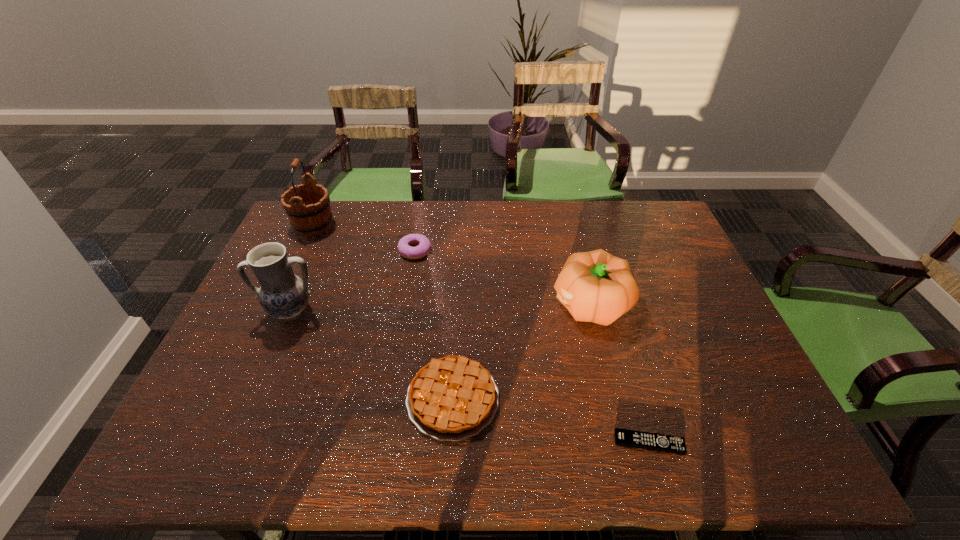
At what (x,y) coordinates should I click in order to perform the action: click on vacant region located 0.320m on the carved face of the third tallest object. Please return your answer as a coordinate pair (x, y). The width and height of the screenshot is (960, 540). Looking at the image, I should click on (437, 304).

The height and width of the screenshot is (540, 960). Find the location of `vacant space located 0.180m on the front of the doughnut`. vacant space located 0.180m on the front of the doughnut is located at coordinates (406, 304).

At what (x,y) coordinates should I click in order to perform the action: click on free space located on the right of the pie. Please return your answer as a coordinate pair (x, y). The image size is (960, 540). Looking at the image, I should click on (x=525, y=399).

This screenshot has height=540, width=960. In order to click on free space located on the right of the shortest object in this screenshot , I will do `click(716, 443)`.

You are a GUI agent. You are given a task and a screenshot of the screen. Output one action in this format:
    pyautogui.click(x=<x>, y=<y>)
    Task: Click on the wine bucket present at the far edge
    The image size is (960, 540).
    Given the screenshot: What is the action you would take?
    pyautogui.click(x=309, y=216)

Where is `doughnut present at the far edge`? This screenshot has height=540, width=960. doughnut present at the far edge is located at coordinates (424, 245).

Where is `pie that is at the near edge`? The image size is (960, 540). pie that is at the near edge is located at coordinates (452, 398).

The width and height of the screenshot is (960, 540). What are the coordinates of `remote control that is at the near edge` in the screenshot? It's located at (623, 437).

Find the location of `wine bucket that is at the left edge`. wine bucket that is at the left edge is located at coordinates (309, 216).

Image resolution: width=960 pixels, height=540 pixels. What are the coordinates of `pottery present at the left edge` in the screenshot? It's located at (282, 294).